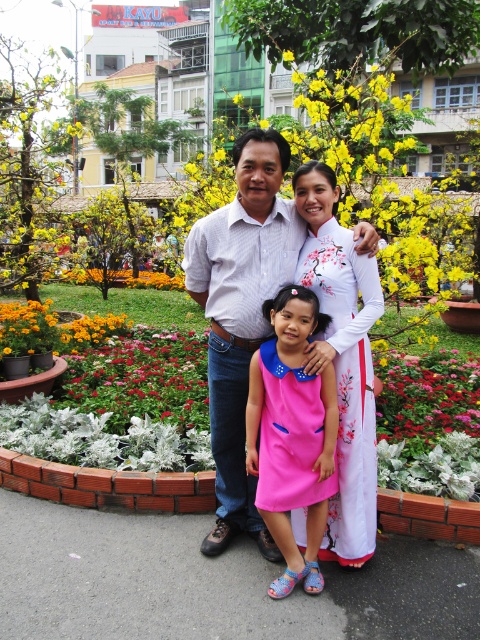
Question: Which of the following is the closest to the observer?

Choices:
 (A) (24, 394)
 (B) (146, 419)
 (C) (448, 307)

Answer: (B)

Question: Is white felt flower bed at lower left to the left of pink fabric flower at center from the viewer's perspective?

Choices:
 (A) yes
 (B) no

Answer: (A)

Question: Does white felt flower bed at lower left have a lesser width compared to pink fabric flower at center?

Choices:
 (A) yes
 (B) no

Answer: (B)

Question: Is white satin ao dai at center above pink fabric flower at center?

Choices:
 (A) yes
 (B) no

Answer: (A)

Question: Which is nearer to the white felt flower bed at lower left?

Choices:
 (A) white satin ao dai at center
 (B) wooden bench at lower center

Answer: (A)

Question: Which object appears closest to the camera in this image?

Choices:
 (A) pink satin dress at center
 (B) pink fabric flower at center
 (C) yellow fabric flower bed at center
 (D) white striped shirt at center

Answer: (A)